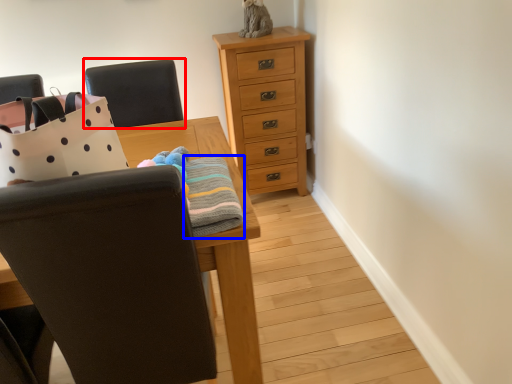
Question: Which of the following is the farthest to the observer, chair (highlighted by a red box) or blanket (highlighted by a blue box)?

Choices:
 (A) chair
 (B) blanket

Answer: (A)